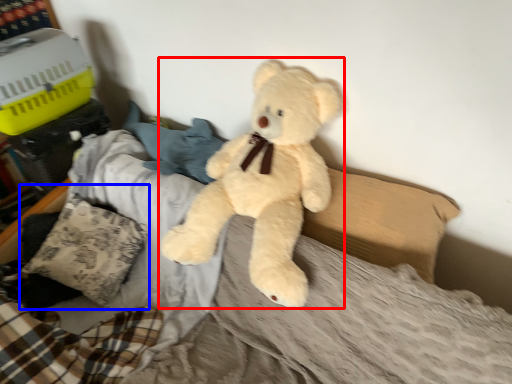
Question: Which object is closer to the camera taking this photo, teddy bear (highlighted by a red box) or pillow (highlighted by a blue box)?

Choices:
 (A) teddy bear
 (B) pillow

Answer: (A)